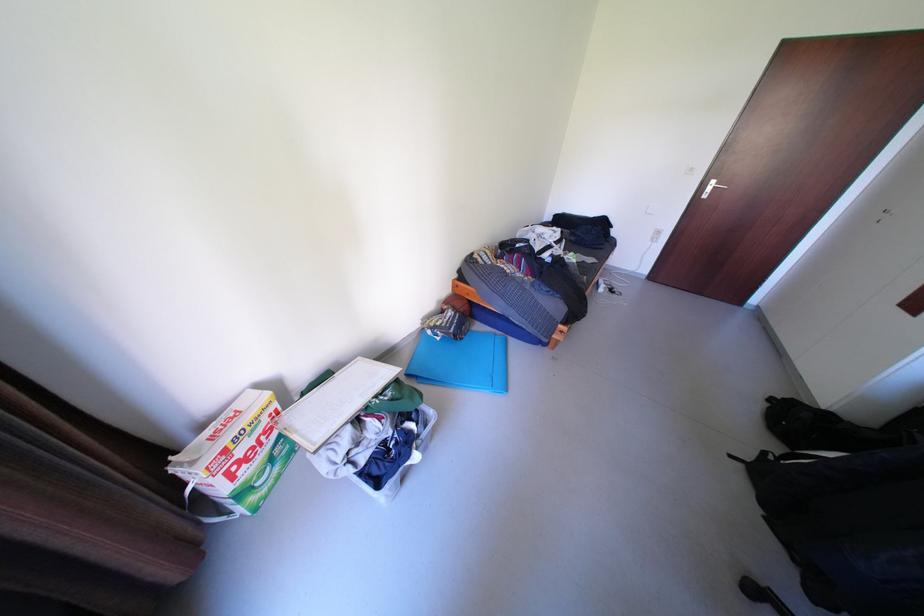
Which object does [846,527] point to?

It refers to a black backpack.